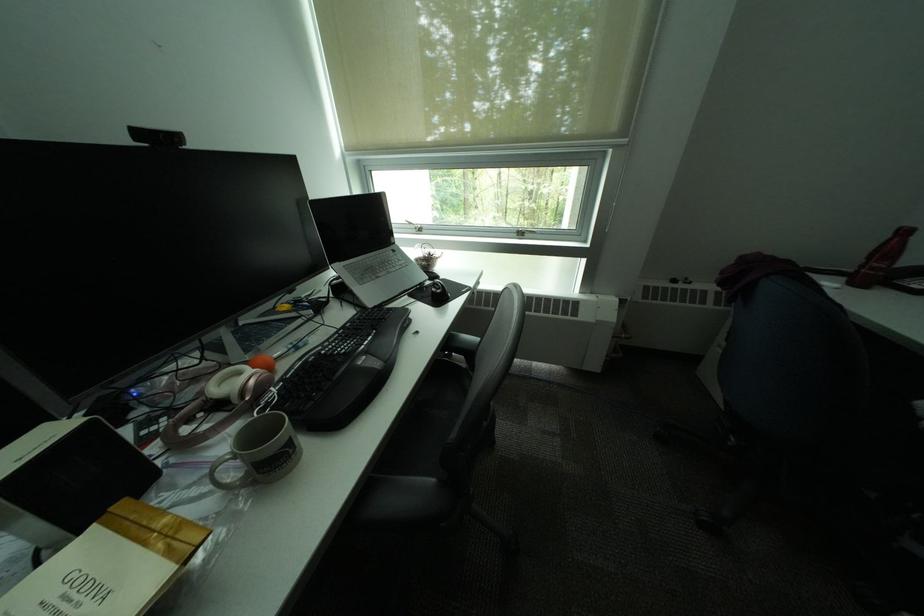
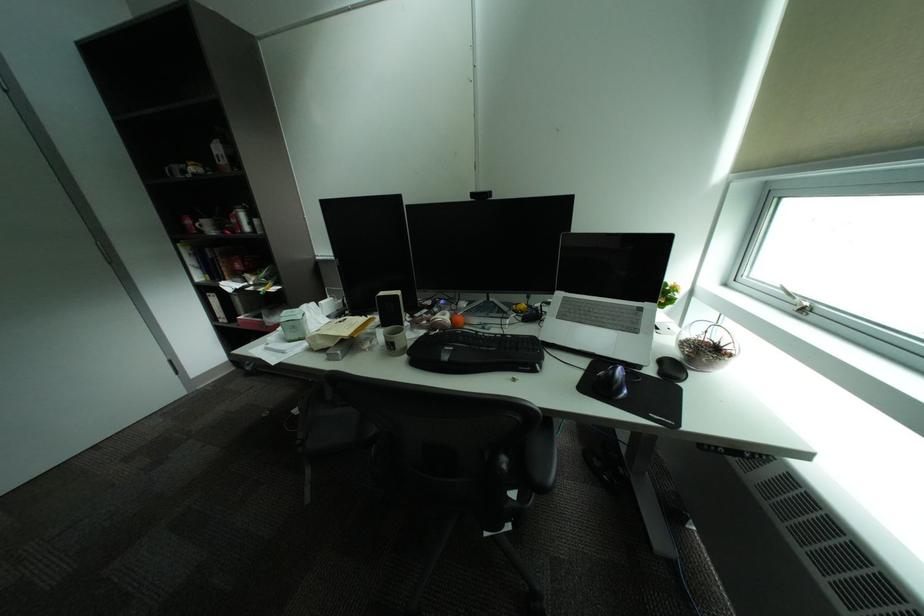
Where in the second image is the point corresponding to point (250, 373) from the first image?

(456, 315)